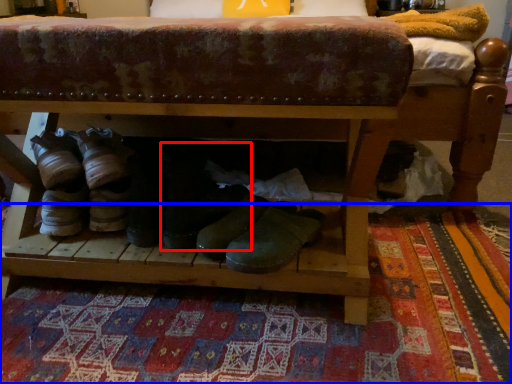
Question: Among these objects, which one is farthest to the camera, footwear (highlighted by a red box) or mat (highlighted by a blue box)?

Choices:
 (A) footwear
 (B) mat

Answer: (A)